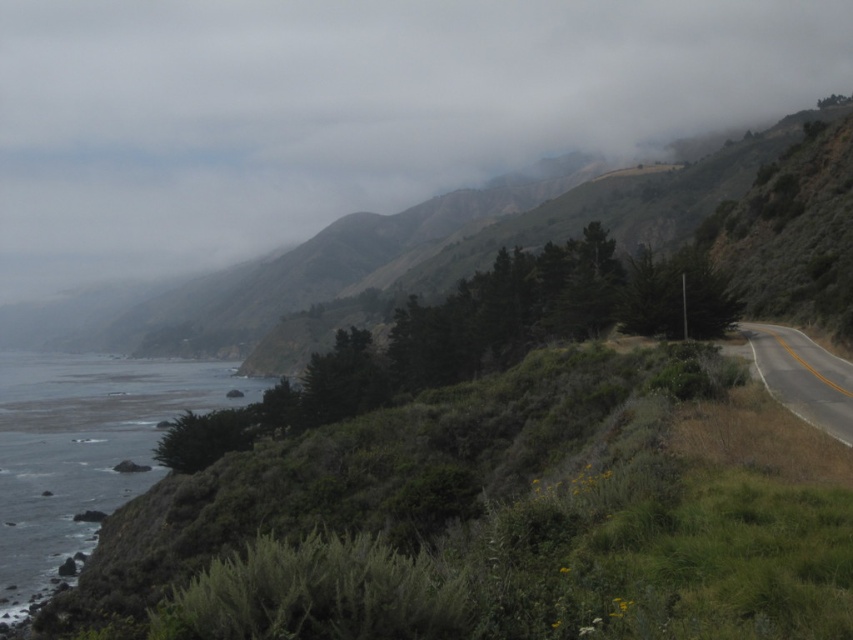
You are driving along the asphalt road at right and notice the foggy misty hillside at upper center in your view. Which of these two objects appears wider from your current position?

The foggy misty hillside at upper center appears wider than the asphalt road at right because its width surpasses that of the asphalt road at right.

You are a hiker standing at the base of the rugged, grassy hillside in the foreground. You see a point marked at coordinates (347,109). What does this point indicate?

The point at coordinates (347,109) indicates the location of the foggy misty hillside at upper center.